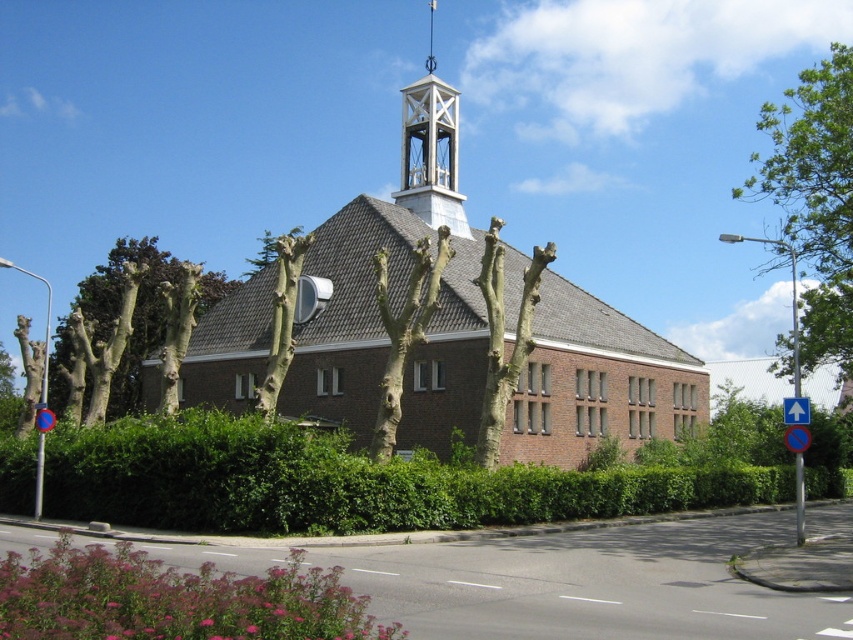
Does brown brick church at center appear on the left side of bare bark tree at center?

No, brown brick church at center is not to the left of bare bark tree at center.

From the picture: Measure the distance between brown brick church at center and camera.

brown brick church at center is 116.38 feet away from camera.

Between point (483, 433) and point (387, 369), which one is positioned in front?

Positioned in front is point (387, 369).

Where is `brown brick church at center`? The image size is (853, 640). brown brick church at center is located at coordinates (473, 326).

This screenshot has width=853, height=640. Find the location of `blue circular sign at left`. blue circular sign at left is located at coordinates (41, 452).

Is point (44, 458) closer to viewer compared to point (793, 396)?

No, (44, 458) is behind (793, 396).

Locate an element on the screen. blue circular sign at left is located at coordinates (41, 452).

Identify the location of bare branches at center. Image resolution: width=853 pixels, height=640 pixels. (282, 317).

This screenshot has width=853, height=640. Describe the element at coordinates (282, 317) in the screenshot. I see `bare branches at center` at that location.

Which is in front, point (256, 403) or point (36, 412)?

Point (36, 412) is more forward.

The image size is (853, 640). I want to click on bare branches at center, so click(x=282, y=317).